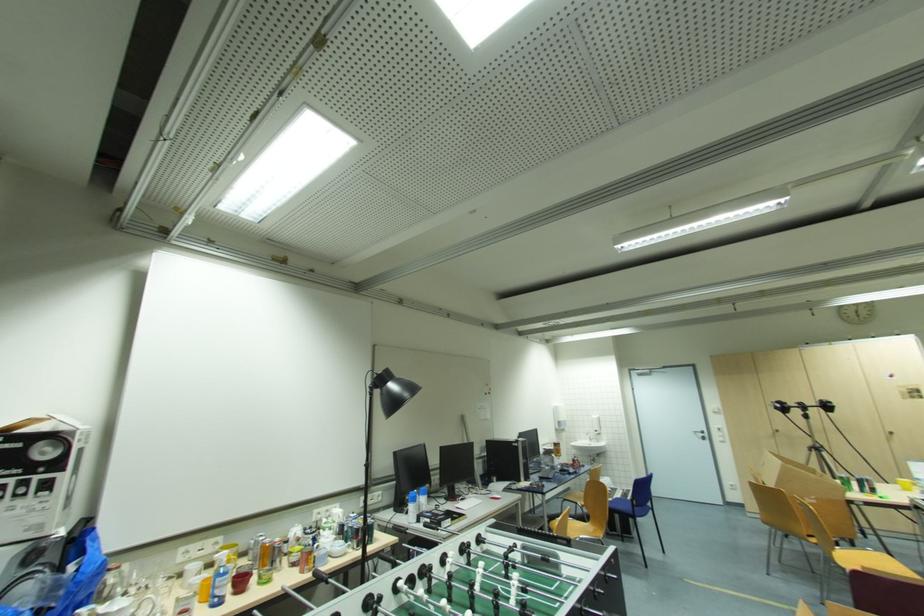
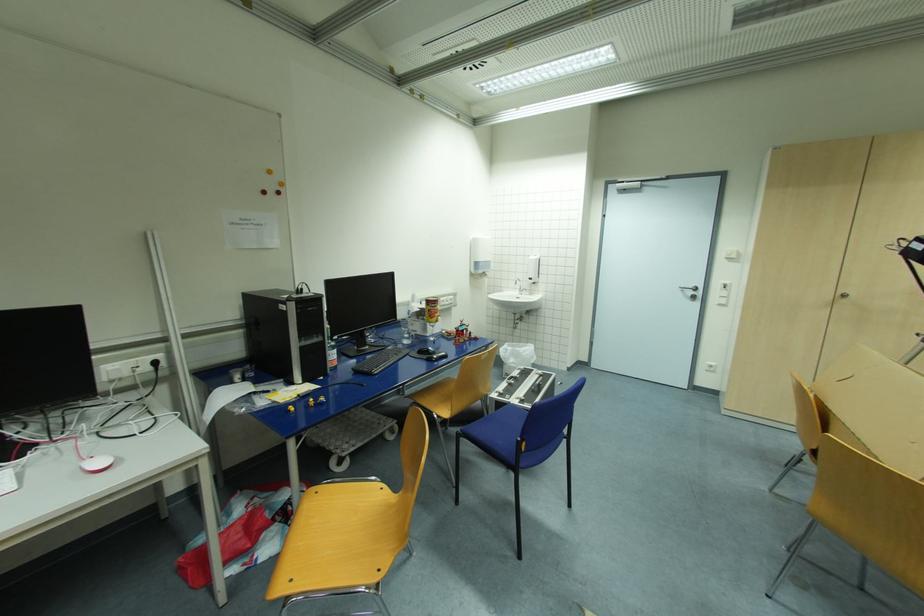
Locate, in the second image, the point that corresponds to (593,440) in the first image.

(525, 291)